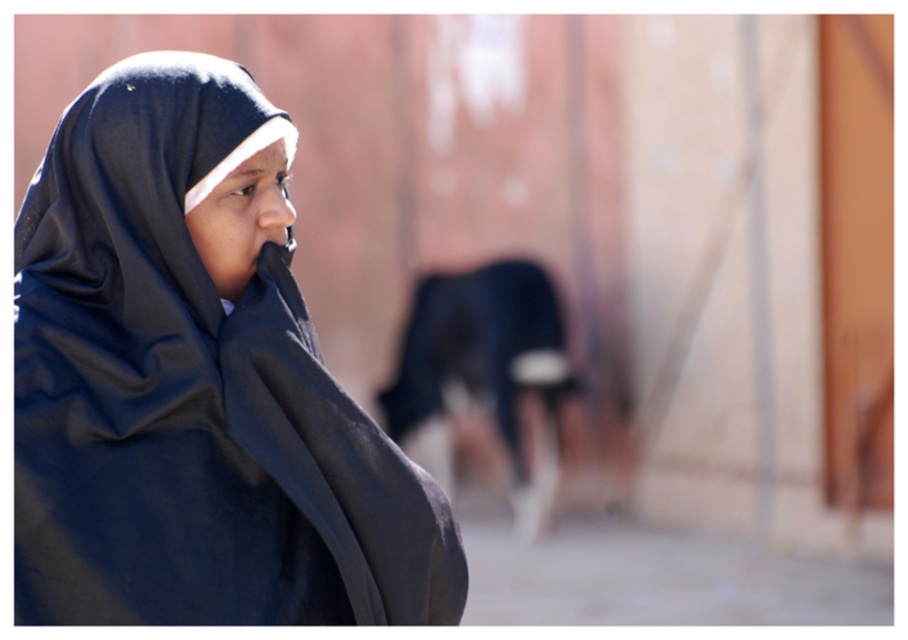
Does point (344, 563) come in front of point (415, 429)?

Yes, point (344, 563) is in front of point (415, 429).

Is point (31, 454) positioned after point (538, 380)?

No, it is in front of (538, 380).

Locate an element on the screen. matte black hijab at left is located at coordinates (195, 385).